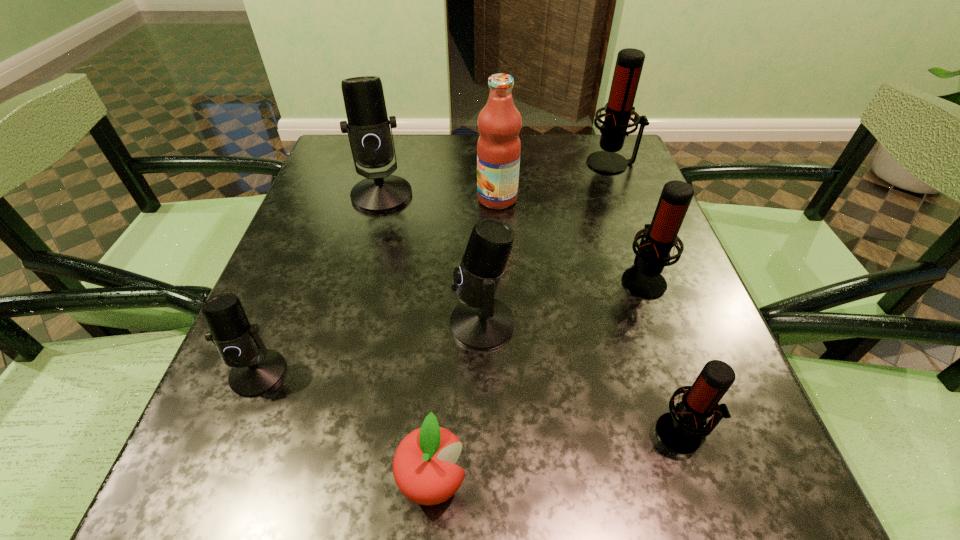
Locate an element on the screen. The height and width of the screenshot is (540, 960). object that is at the far right corner is located at coordinates (619, 110).

Find the location of `object located in the near right corner section of the desktop`. object located in the near right corner section of the desktop is located at coordinates (681, 431).

In the image, there is a desktop. Where is `vacant region at the far edge`? The height and width of the screenshot is (540, 960). vacant region at the far edge is located at coordinates (448, 154).

The image size is (960, 540). Find the location of `free point at the left edge`. free point at the left edge is located at coordinates (352, 228).

I want to click on vacant area at the right edge, so click(675, 252).

You are a GUI agent. You are given a task and a screenshot of the screen. Output one action in this format:
    pyautogui.click(x=<x>, y=<y>)
    Task: Click on the vacant space at the far left corner of the desktop
    The width and height of the screenshot is (960, 540).
    Given the screenshot: What is the action you would take?
    pyautogui.click(x=350, y=153)

Where is `vacant space at the near left corner of the desktop`? The height and width of the screenshot is (540, 960). vacant space at the near left corner of the desktop is located at coordinates (172, 505).

Find the location of a particular element. free spot between the nearest black microphone and the farthest black microphone is located at coordinates (320, 284).

Where is `free space between the fruit juice and the fifth nearest object`? free space between the fruit juice and the fifth nearest object is located at coordinates (570, 239).

Identify the location of free spot between the second nearest black microphone and the fourth farthest object. (563, 301).